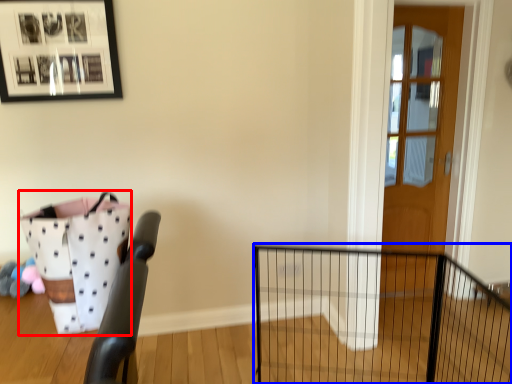
Question: Which object is closer to the camera taking this photo, basket (highlighted by a red box) or fence (highlighted by a blue box)?

Choices:
 (A) basket
 (B) fence

Answer: (A)